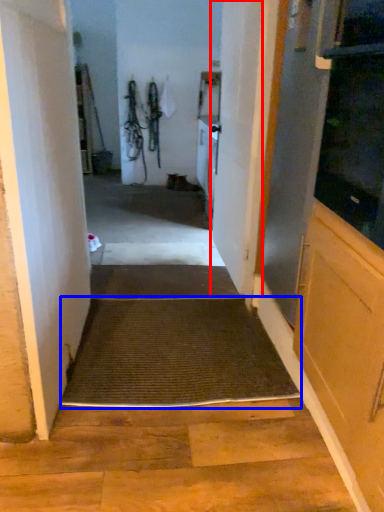
Question: Which object is closer to the camera taking this photo, door (highlighted by a red box) or doormat (highlighted by a blue box)?

Choices:
 (A) door
 (B) doormat

Answer: (B)